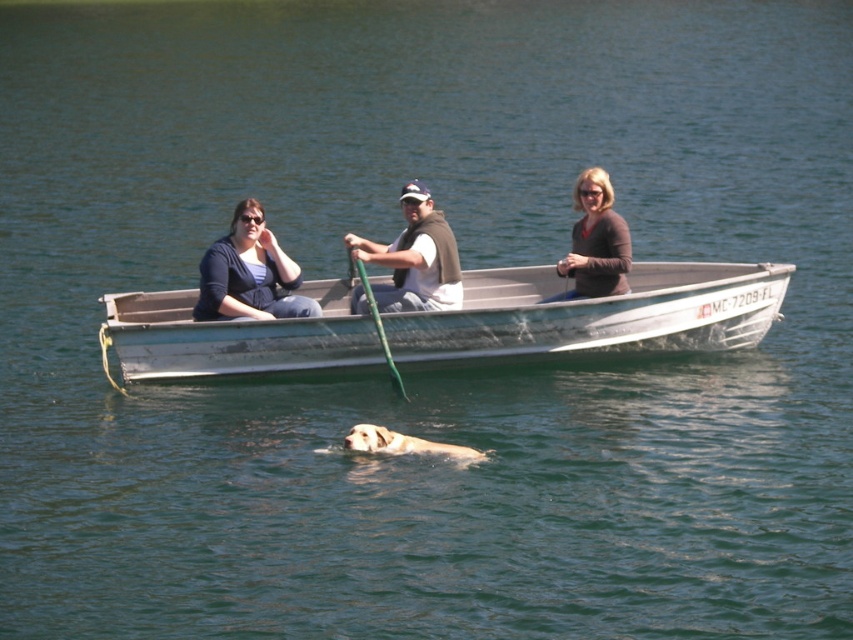
You are a photographer taking a picture of the matte brown sweater at center and the light brown fur dog at center. Which object is covering the other one in the image?

The matte brown sweater at center is positioned over the light brown fur dog at center, so it is covering the dog.

You are a photographer planning to take a portrait of the two people in the boat. You want to ensure that both the matte black sweater at left and the white cotton shirt at center are clearly visible in the frame. Given their heights, which person should you position closer to the camera to avoid any part of them being obscured by the other?

Since the matte black sweater at left is shorter than the white cotton shirt at center, you should position the person in the matte black sweater at left closer to the camera to ensure both are visible without obstruction.